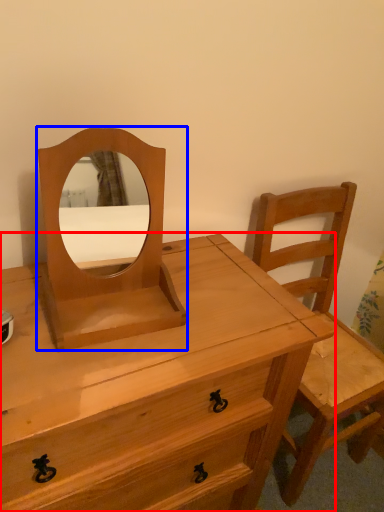
Question: Which object is closer to the camera taking this photo, chest of drawers (highlighted by a red box) or mirror (highlighted by a blue box)?

Choices:
 (A) chest of drawers
 (B) mirror

Answer: (A)